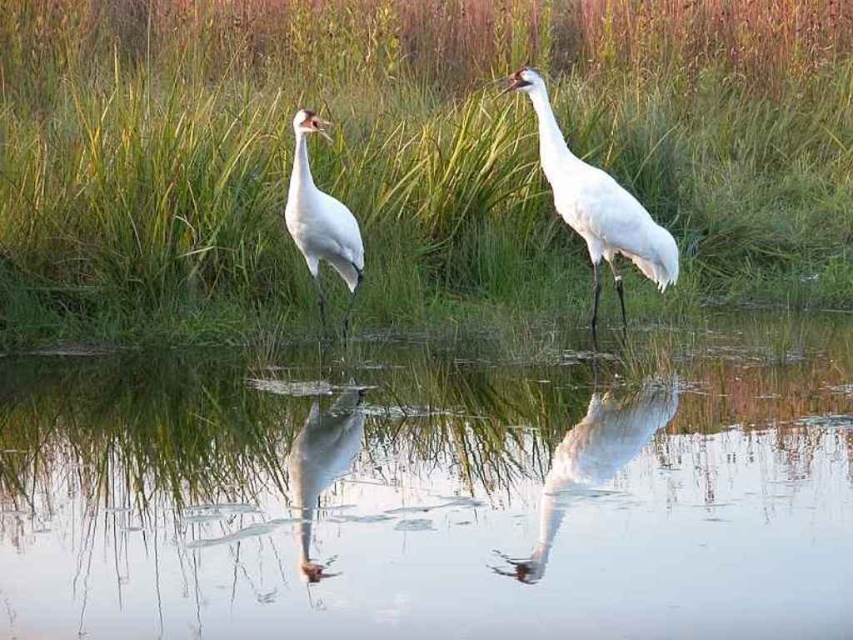
Question: Is green grass at center behind white feathered crane at left?

Choices:
 (A) no
 (B) yes

Answer: (B)

Question: In this image, where is green grass at center located relative to white feathered crane at upper center?

Choices:
 (A) below
 (B) above

Answer: (B)

Question: Which object is positioned closest to the white feathered crane at upper center?

Choices:
 (A) white feathered crane at left
 (B) clear water at center
 (C) green grass at center
 (D) white glossy bird at center

Answer: (D)

Question: Based on their relative distances, which object is nearer to the white feathered crane at upper center?

Choices:
 (A) white feathered crane at left
 (B) white glossy bird at center

Answer: (B)

Question: Which point appears farthest from the camera in this image?

Choices:
 (A) (549, 179)
 (B) (318, 248)

Answer: (B)

Question: Considering the relative positions of clear water at center and white glossy bird at center in the image provided, where is clear water at center located with respect to white glossy bird at center?

Choices:
 (A) right
 (B) left

Answer: (B)